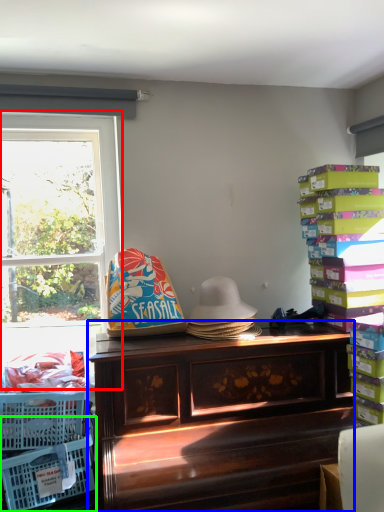
Question: Which is farther away from window (highlighted by a red box)? desk (highlighted by a blue box) or basket (highlighted by a green box)?

Choices:
 (A) desk
 (B) basket

Answer: (B)